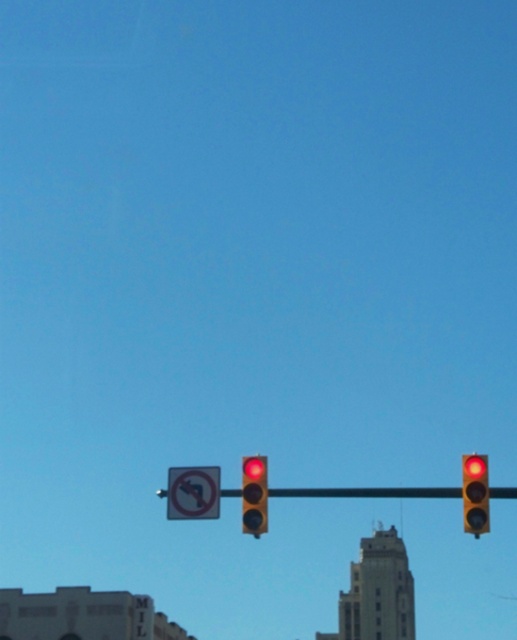
Can you confirm if black plastic sign at center is positioned above red glass traffic light at center?

Incorrect, black plastic sign at center is not positioned above red glass traffic light at center.

Does black plastic sign at center appear on the right side of red glass traffic light at center?

Incorrect, black plastic sign at center is not on the right side of red glass traffic light at center.

The width and height of the screenshot is (517, 640). Find the location of `black plastic sign at center`. black plastic sign at center is located at coordinates (192, 492).

Is metallic yellow pole at center thinner than red glass traffic light at center?

No, metallic yellow pole at center is not thinner than red glass traffic light at center.

Which is behind, point (424, 492) or point (248, 472)?

Positioned behind is point (424, 492).

Image resolution: width=517 pixels, height=640 pixels. I want to click on metallic yellow pole at center, so click(368, 492).

Looking at this image, which is more to the left, matte glass traffic light at upper center or red glass traffic light at center?

From the viewer's perspective, red glass traffic light at center appears more on the left side.

Between point (477, 508) and point (253, 461), which one is positioned in front?

Point (477, 508) is more forward.

Is point (478, 458) positioned after point (246, 472)?

No.

At what (x,y) coordinates should I click in order to perform the action: click on matte glass traffic light at upper center. Please return your answer as a coordinate pair (x, y). Image resolution: width=517 pixels, height=640 pixels. Looking at the image, I should click on (476, 493).